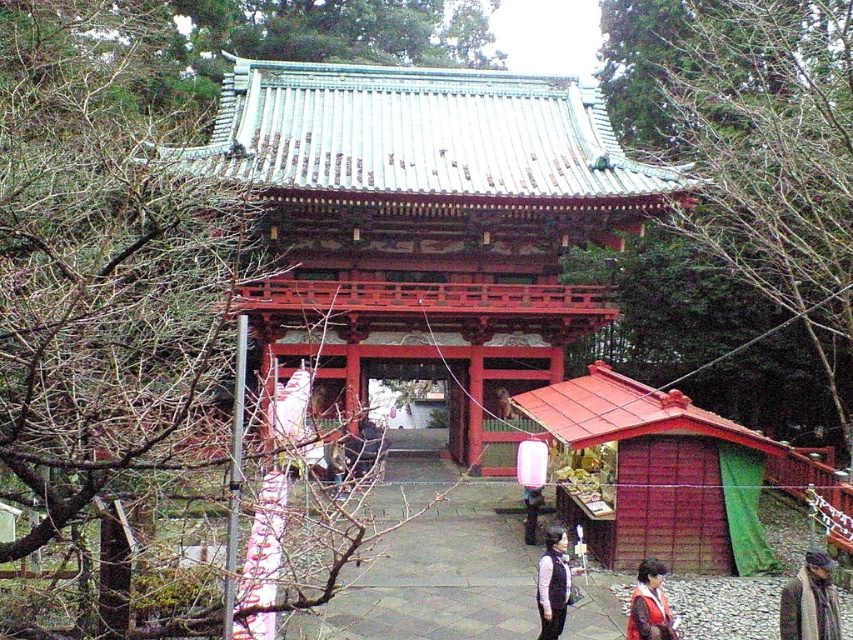
You are a visitor standing at the entrance of the temple complex. You want to walk straight towards the shiny red wooden gate at center. How many steps would you need to take to reach it if each step covers approximately 3 feet?

The shiny red wooden gate at center is 66.66 feet away from the viewer. Since each step covers about 3 feet, you would need to take approximately 22 steps to reach it.

You are a visitor approaching the temple and want to enter through the shiny red wooden gate at center. The smooth stone path at center leads directly to the gate. Since you are carrying a large package that is 2 meters tall, will the gate allow you to pass through without bending down?

The shiny red wooden gate at center is taller than the smooth stone path at center. Since the gate is taller than the path, and your package is 2 meters tall, you should be able to pass through the gate without bending down as long as the gate height exceeds 2 meters. However, the exact height isn not provided, so it depends on whether the gate is sufficiently tall.